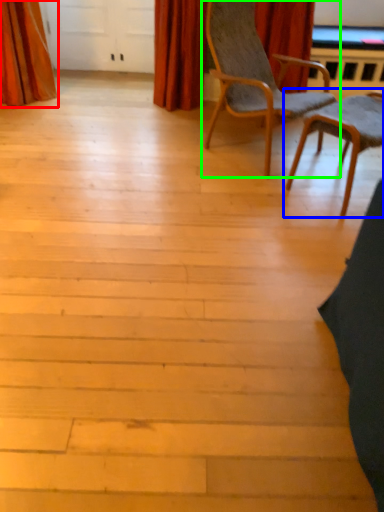
Question: Considering the real-world distances, which object is farthest from curtain (highlighted by a red box)? chair (highlighted by a blue box) or chair (highlighted by a green box)?

Choices:
 (A) chair
 (B) chair

Answer: (A)